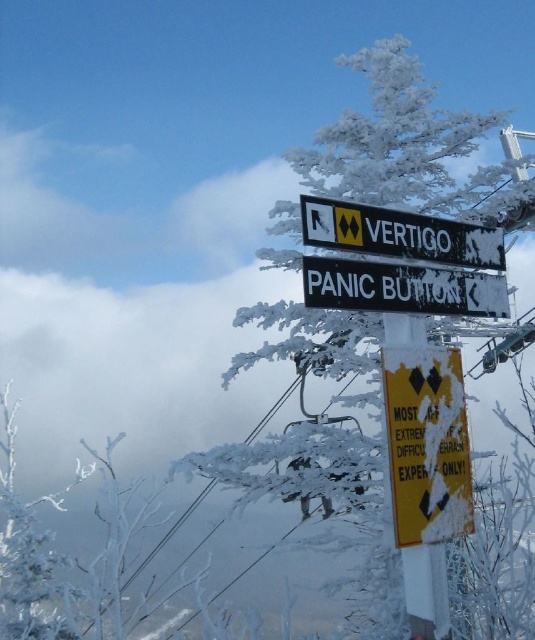
Can you confirm if yellow reflective sign at center is positioned below black plastic sign at center?

Indeed, yellow reflective sign at center is positioned under black plastic sign at center.

Consider the image. Which of these two, yellow reflective sign at center or black plastic sign at center, stands shorter?

black plastic sign at center is shorter.

The width and height of the screenshot is (535, 640). What do you see at coordinates (425, 454) in the screenshot? I see `yellow reflective sign at center` at bounding box center [425, 454].

Locate an element on the screen. yellow reflective sign at center is located at coordinates [x=425, y=454].

At what (x,y) coordinates should I click in order to perform the action: click on black plastic sign at center. Please return your answer as a coordinate pair (x, y). The width and height of the screenshot is (535, 640). Looking at the image, I should click on (401, 289).

Where is `black plastic sign at center`? black plastic sign at center is located at coordinates (401, 289).

Is frosted snow-covered tree at upper center smaller than yellow reflective sign at center?

Incorrect, frosted snow-covered tree at upper center is not smaller in size than yellow reflective sign at center.

Where is `frosted snow-covered tree at upper center`? This screenshot has width=535, height=640. frosted snow-covered tree at upper center is located at coordinates (407, 147).

Identify the location of frosted snow-covered tree at upper center. (407, 147).